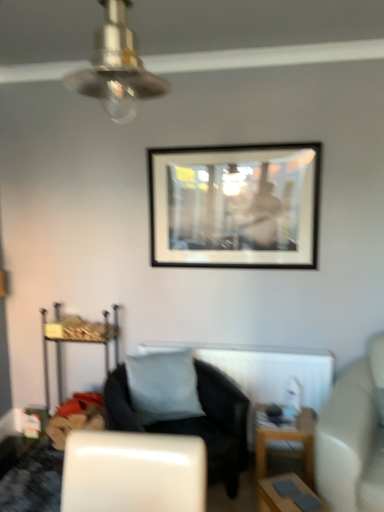
This screenshot has height=512, width=384. In order to click on free space above black matte picture frame at upper center (from a real-world perspective) in this screenshot , I will do `click(232, 142)`.